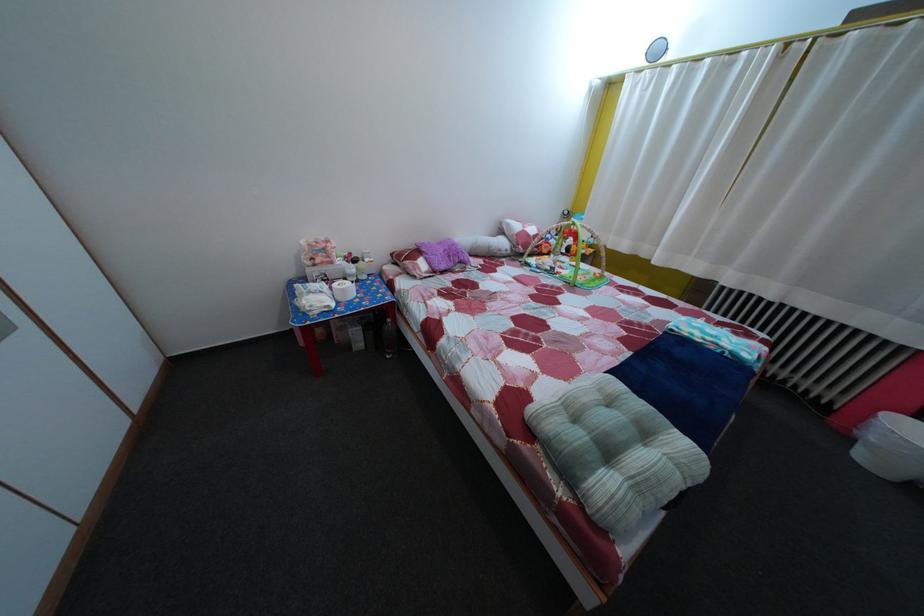
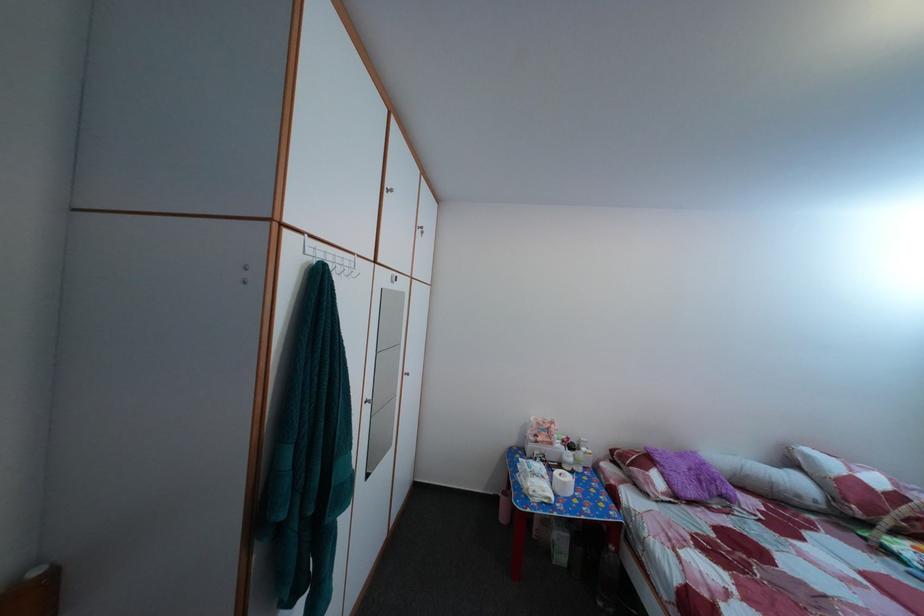
Locate, in the second image, the point that corresponds to pixel 509 257 in the first image.

(808, 504)